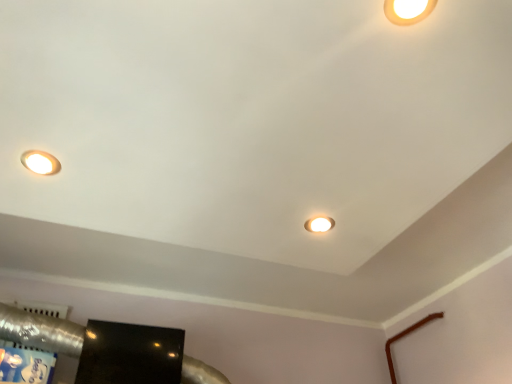
Question: In terms of size, does matte white lamp at upper left, marked as the 2th lamp in a back-to-front arrangement, appear bigger or smaller than matte white lamp at center, which appears as the first lamp when ordered from the bottom?

Choices:
 (A) small
 (B) big

Answer: (A)

Question: From the image's perspective, is matte white lamp at upper left, marked as the 2th lamp in a back-to-front arrangement, above or below matte white lamp at center, acting as the 2th lamp starting from the left?

Choices:
 (A) above
 (B) below

Answer: (A)

Question: Estimate the real-world distances between objects in this image. Which object is farther from the matte white lamp at upper left, which appears as the third lamp when viewed from the right?

Choices:
 (A) matte white lamp at upper right, which appears as the third lamp when viewed from the back
 (B) glossy black tv at lower left
 (C) matte white lamp at center, which is counted as the third lamp, starting from the top

Answer: (A)

Question: Estimate the real-world distances between objects in this image. Which object is farther from the matte white lamp at upper left, marked as the 2th lamp in a back-to-front arrangement?

Choices:
 (A) matte white lamp at center, which appears as the first lamp when ordered from the bottom
 (B) matte white lamp at upper right, which ranks as the 1th lamp in right-to-left order
 (C) glossy black tv at lower left

Answer: (B)